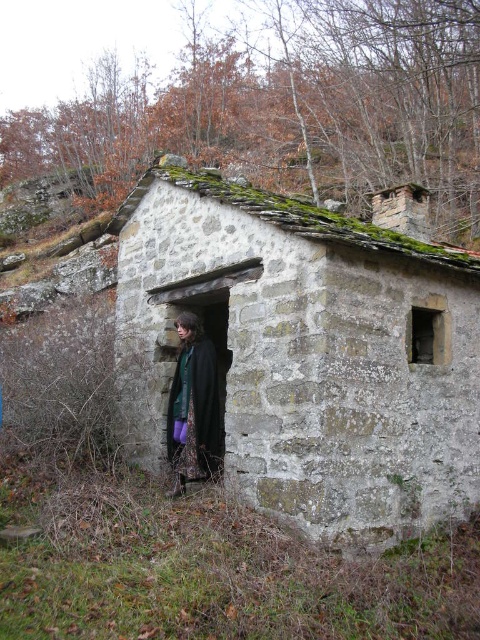
Between stone textured hut at center and black woolen coat at center, which one appears on the right side from the viewer's perspective?

stone textured hut at center

Who is more distant from viewer, (285,397) or (207,353)?

Positioned behind is point (207,353).

Find the location of a particular element. stone textured hut at center is located at coordinates (310, 349).